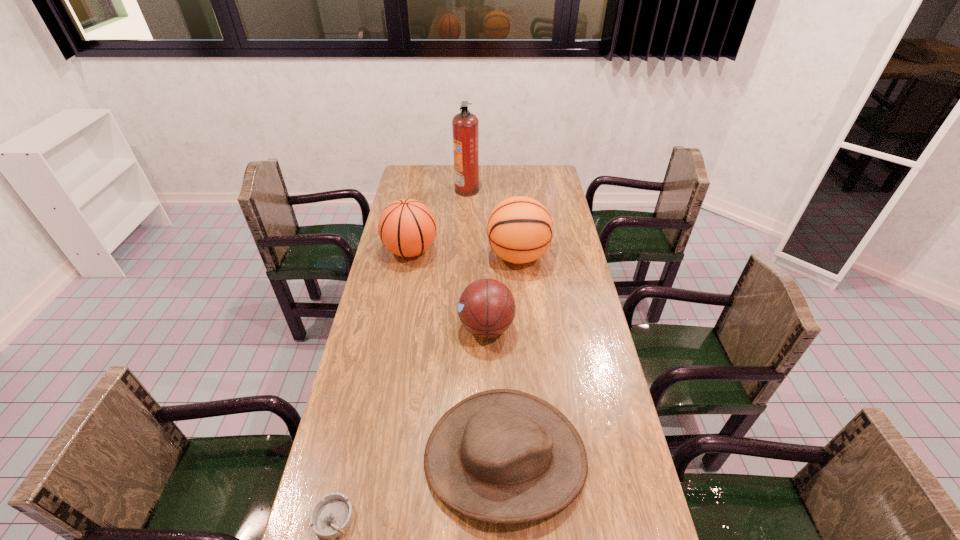
This screenshot has width=960, height=540. In order to click on the farthest object in this screenshot , I will do `click(465, 126)`.

Where is `the tallest object`? the tallest object is located at coordinates (465, 126).

The image size is (960, 540). I want to click on the leftmost basketball, so click(407, 227).

You are a GUI agent. You are given a task and a screenshot of the screen. Output one action in this format:
    pyautogui.click(x=<x>, y=<y>)
    Task: Click on the shortest basketball
    The image size is (960, 540).
    Given the screenshot: What is the action you would take?
    pyautogui.click(x=486, y=308)

Where is `the nearest basketball`? the nearest basketball is located at coordinates (486, 308).

This screenshot has height=540, width=960. I want to click on the fifth tallest object, so click(x=504, y=456).

Locate an element on the screen. vacant space located 0.210m at the nozzle of the fire extinguisher is located at coordinates (522, 190).

Where is `blank space located 0.370m on the right of the leftmost basketball`? blank space located 0.370m on the right of the leftmost basketball is located at coordinates (530, 251).

The image size is (960, 540). In order to click on vacant region located 0.330m on the front of the fourth farthest object in this screenshot , I will do `click(489, 449)`.

Find the location of a particular element. vacant space located 0.090m on the right of the fifth tallest object is located at coordinates (621, 457).